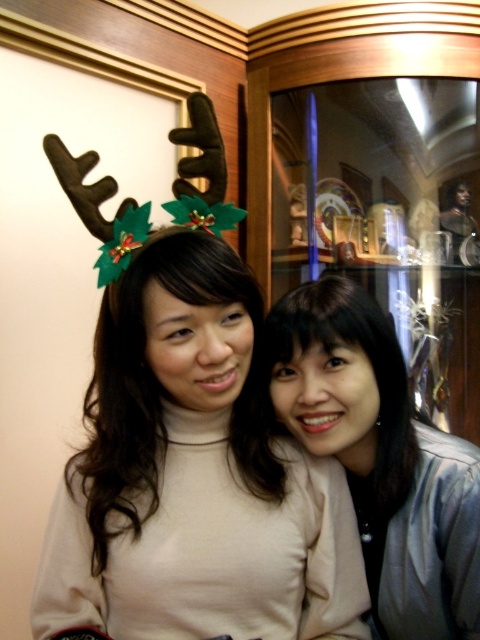
Question: Which point is farther to the camera?

Choices:
 (A) (160, 442)
 (B) (386, 436)

Answer: (B)

Question: Can you confirm if matte brown antlers at center is positioned above matte beige sweater at center?

Choices:
 (A) no
 (B) yes

Answer: (B)

Question: Which object appears closest to the camera in this image?

Choices:
 (A) matte brown antlers at center
 (B) matte beige sweater at center

Answer: (A)

Question: Is matte brown antlers at center below matte beige sweater at center?

Choices:
 (A) yes
 (B) no

Answer: (B)

Question: Which object is farther from the camera taking this photo?

Choices:
 (A) matte beige sweater at center
 (B) matte brown antlers at center

Answer: (A)

Question: Is matte brown antlers at center to the right of matte beige sweater at center from the viewer's perspective?

Choices:
 (A) no
 (B) yes

Answer: (A)